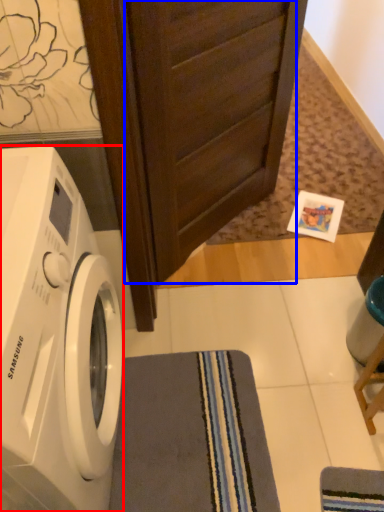
Question: Which object appears farthest to the camera in this image, washing machine (highlighted by a red box) or screen door (highlighted by a blue box)?

Choices:
 (A) washing machine
 (B) screen door

Answer: (B)